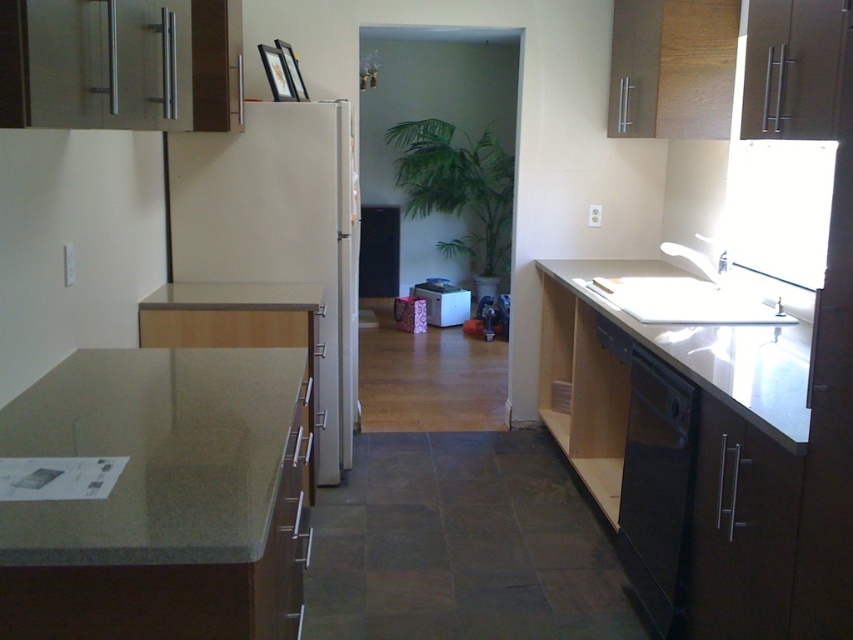
Question: Which of the following is the farthest from the observer?

Choices:
 (A) (440, 211)
 (B) (431, 323)

Answer: (A)

Question: Which object is positioned closest to the granite countertop at lower left?

Choices:
 (A) green leafy plant at center
 (B) white plastic microwave at center
 (C) black matte dishwasher at lower right

Answer: (C)

Question: Which point is farther to the camera?

Choices:
 (A) (26, 452)
 (B) (422, 172)

Answer: (B)

Question: Is black matte dishwasher at lower right bigger than white glossy sink at upper right?

Choices:
 (A) yes
 (B) no

Answer: (B)

Question: Is green leafy plant at center closer to camera compared to white plastic microwave at center?

Choices:
 (A) yes
 (B) no

Answer: (B)

Question: Does white glossy countertop at right have a larger size compared to green leafy plant at center?

Choices:
 (A) no
 (B) yes

Answer: (B)